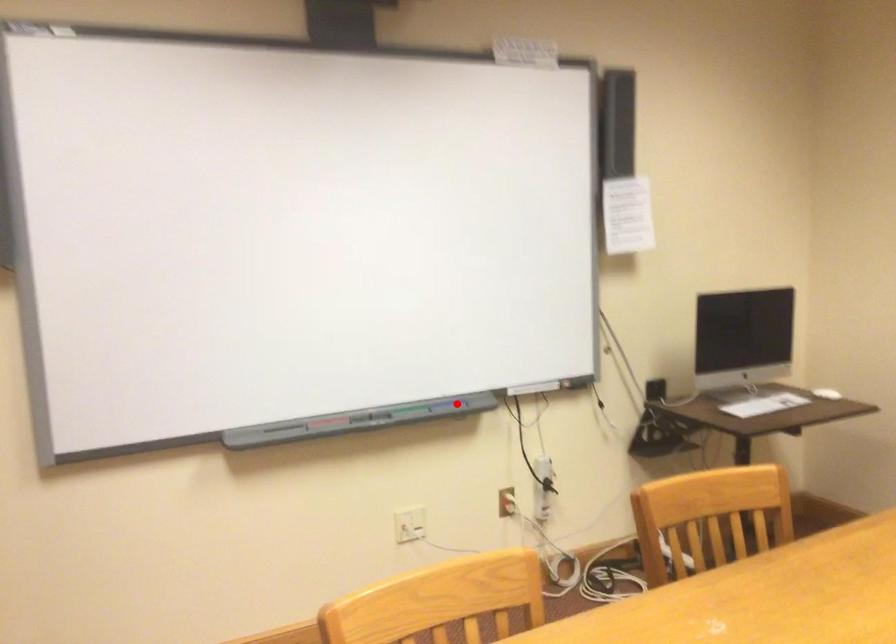
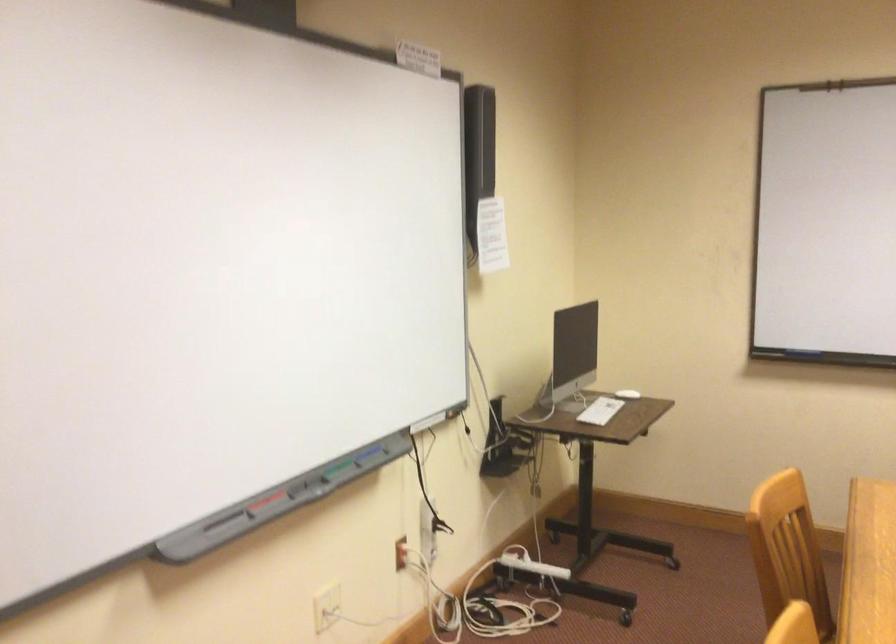
Question: I am providing you with two images of the same scene from different viewpoints. In image1, a red point is highlighted. Considering the same 3D point in image2, which of the following is correct?

Choices:
 (A) It is closer
 (B) It is farther

Answer: (A)